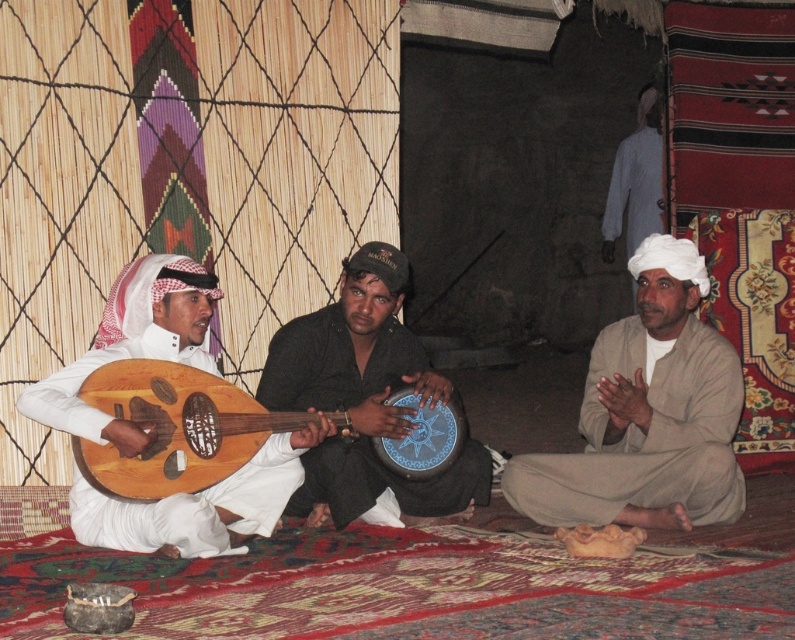
You are a photographer trying to capture a closeup of the beige cotton turban at right and the wooden banjo at left. Given that your camera can only focus on objects wider than 15 cm, will both items be in focus?

The beige cotton turban at right is less than 15 cm wide since its width is less than the wooden banjo at left, but the wooden banjo at left is wider than 15 cm. Therefore, the wooden banjo at left will be in focus, but the beige cotton turban at right may not be.

You are standing at the camera position and want to take a photo of the three men. If you move forward by 2 meters, how far will you be from the point at (348, 275)?

If you move forward by 2 meters from the camera position, your new distance to the point at (348, 275) would be 4.95 meters minus 2 meters, which equals 2.95 meters.

You are a photographer standing in front of the scene. You want to take a photo of the beige cotton turban at right and the wooden banjo at left. The minimum distance between the two objects to ensure both are in focus is 1 meter. Can you capture both in focus?

The beige cotton turban at right is 1.10 meters from the wooden banjo at left. Since the minimum required distance is 1 meter, the photographer can capture both in focus as the distance meets the requirement.